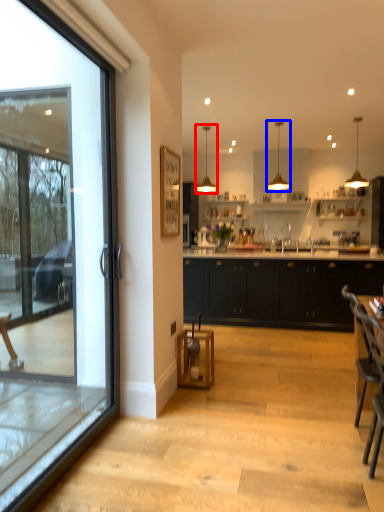
Question: Which object is closer to the camera taking this photo, lamp (highlighted by a red box) or lamp (highlighted by a blue box)?

Choices:
 (A) lamp
 (B) lamp

Answer: (B)